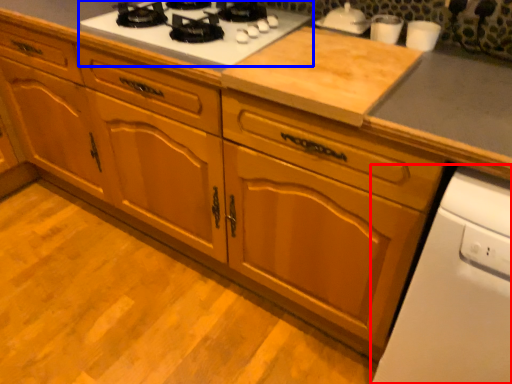
Question: Which of the following is the farthest to the observer, home appliance (highlighted by a red box) or gas stove (highlighted by a blue box)?

Choices:
 (A) home appliance
 (B) gas stove

Answer: (B)